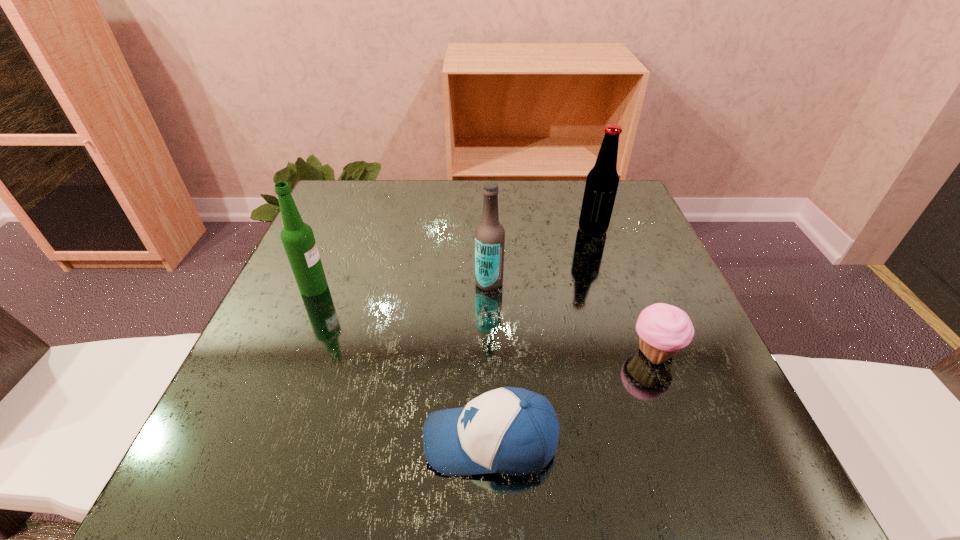
Find the location of a particular element. The height and width of the screenshot is (540, 960). free space located on the label of the second beer bottle from left to right is located at coordinates (428, 282).

This screenshot has width=960, height=540. In order to click on vacant space situated on the back of the cupcake in this screenshot , I will do `click(607, 227)`.

Find the location of a particular element. This screenshot has height=540, width=960. free space located 0.160m on the front-facing side of the baseball cap is located at coordinates click(318, 441).

Locate an element on the screen. The width and height of the screenshot is (960, 540). blank space located 0.150m on the front-facing side of the baseball cap is located at coordinates (324, 441).

This screenshot has height=540, width=960. Identify the location of vacant position located 0.120m on the front-facing side of the baseball cap. (345, 441).

Locate an element on the screen. Image resolution: width=960 pixels, height=540 pixels. object that is positioned at the far edge is located at coordinates (602, 181).

Where is `object that is at the near edge`? The image size is (960, 540). object that is at the near edge is located at coordinates (509, 430).

In order to click on object situated at the left edge in this screenshot , I will do `click(297, 237)`.

I want to click on beer bottle situated at the right edge, so click(602, 181).

Locate an element on the screen. Image resolution: width=960 pixels, height=540 pixels. cupcake that is at the right edge is located at coordinates (663, 329).